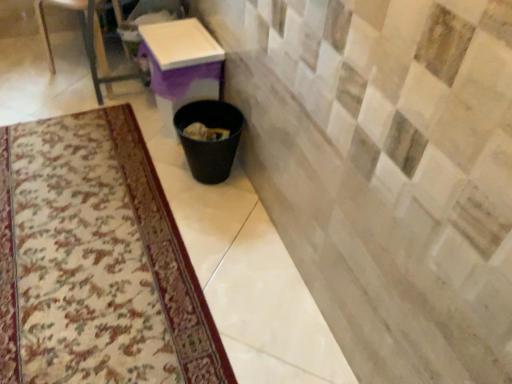
Find the location of `vacant area to the left of metallic glass table at upper left`. vacant area to the left of metallic glass table at upper left is located at coordinates (31, 71).